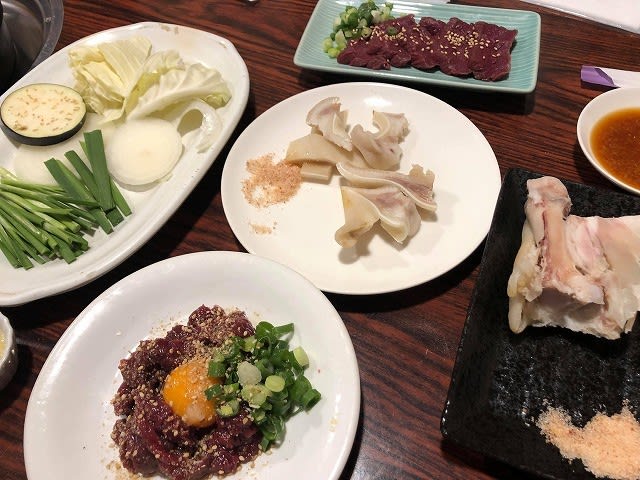
Locate an element on the screen. The width and height of the screenshot is (640, 480). empty space on table is located at coordinates (258, 56).